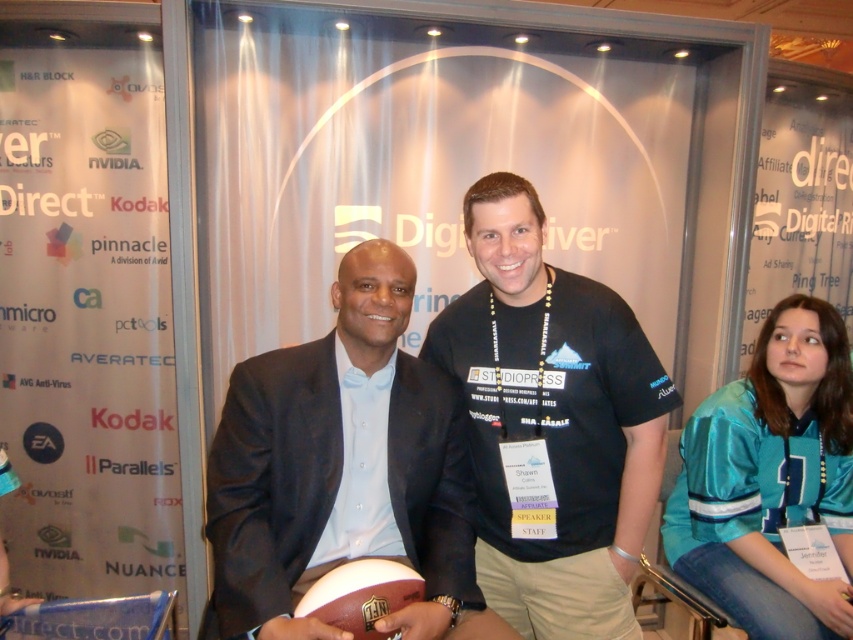
Question: Which object is farther from the camera taking this photo?

Choices:
 (A) teal satin jersey at right
 (B) matte black suit at center

Answer: (A)

Question: Which point appears closest to the camera in this image?

Choices:
 (A) (397, 406)
 (B) (749, 449)
 (C) (572, 280)

Answer: (A)

Question: Can you confirm if black matte t-shirt at center is positioned below teal satin jersey at right?

Choices:
 (A) yes
 (B) no

Answer: (B)

Question: Is matte black suit at center closer to the viewer compared to teal satin jersey at right?

Choices:
 (A) yes
 (B) no

Answer: (A)

Question: Is black matte t-shirt at center below teal satin jersey at right?

Choices:
 (A) no
 (B) yes

Answer: (A)

Question: Which point is closer to the camera?

Choices:
 (A) teal satin jersey at right
 (B) matte black suit at center

Answer: (B)